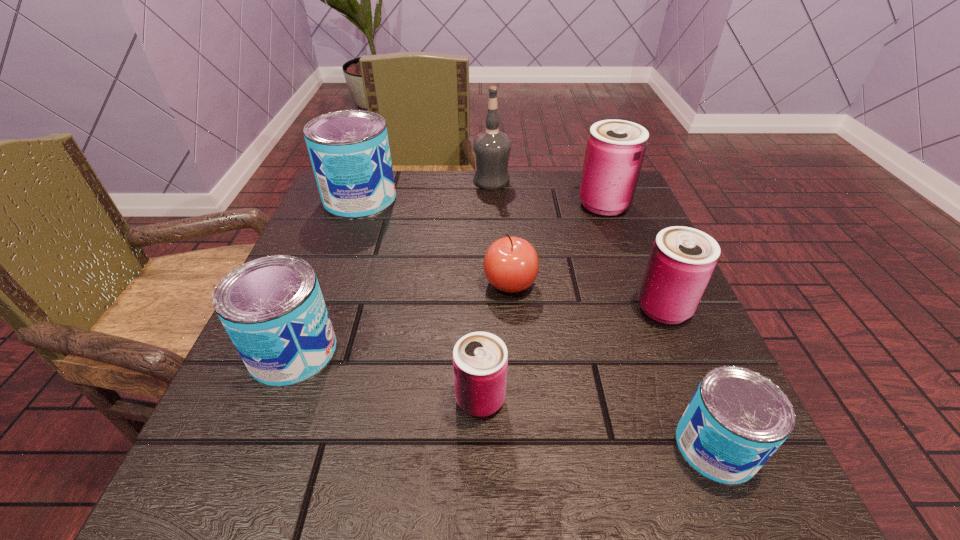
Find the location of `vacant space located on the front label of the tallest object`. vacant space located on the front label of the tallest object is located at coordinates (437, 181).

The height and width of the screenshot is (540, 960). I want to click on vacant space located on the front label of the tallest object, so click(x=437, y=181).

Image resolution: width=960 pixels, height=540 pixels. What are the coordinates of `vacant space located 0.130m on the front label of the tallest object` in the screenshot? It's located at (421, 181).

Identify the location of vacant space situated on the right of the farthest blue can. (485, 199).

Where is `vacant region located 0.200m on the left of the farthest pink can`? The image size is (960, 540). vacant region located 0.200m on the left of the farthest pink can is located at coordinates (492, 204).

Where is `vacant space situated on the left of the second farthest pink can`? This screenshot has height=540, width=960. vacant space situated on the left of the second farthest pink can is located at coordinates (420, 308).

Locate an element on the screen. free region located 0.280m on the right of the second nearest blue can is located at coordinates (511, 352).

Find the location of a particular element. vacant position located on the left of the apple is located at coordinates (387, 284).

Find the location of a particular element. blank space located 0.250m on the right of the nearest pink can is located at coordinates (677, 399).

This screenshot has height=540, width=960. What are the coordinates of `free spot located 0.130m on the left of the nearest blue can` in the screenshot? It's located at (580, 447).